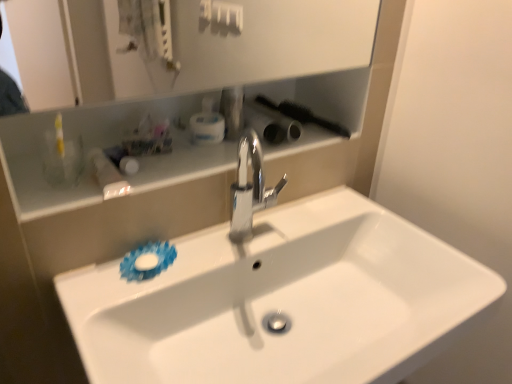
I want to click on free space in front of white plastic container at upper center, positioned as the second toiletry in left-to-right order, so click(x=194, y=159).